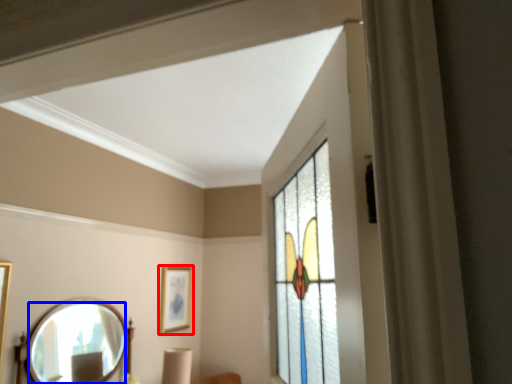
Question: Which of the following is the closest to the observer, picture frame (highlighted by a red box) or mirror (highlighted by a blue box)?

Choices:
 (A) picture frame
 (B) mirror

Answer: (B)